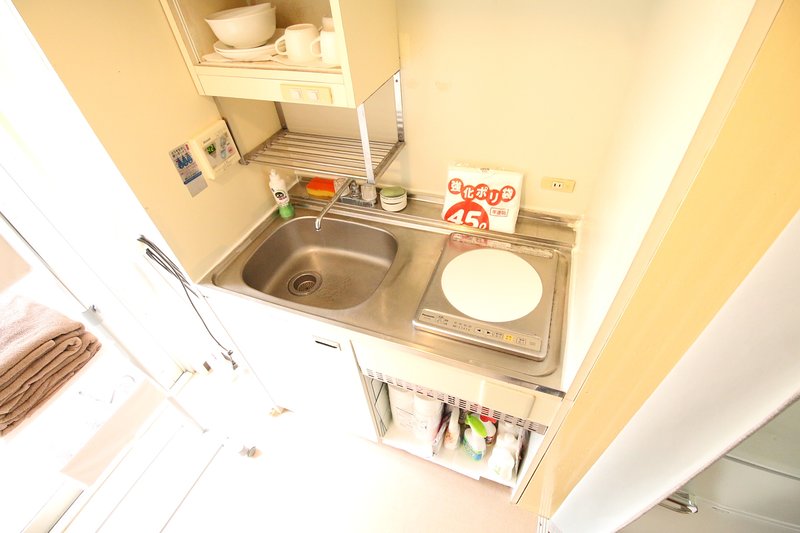
I want to click on white bowl, so click(250, 34).